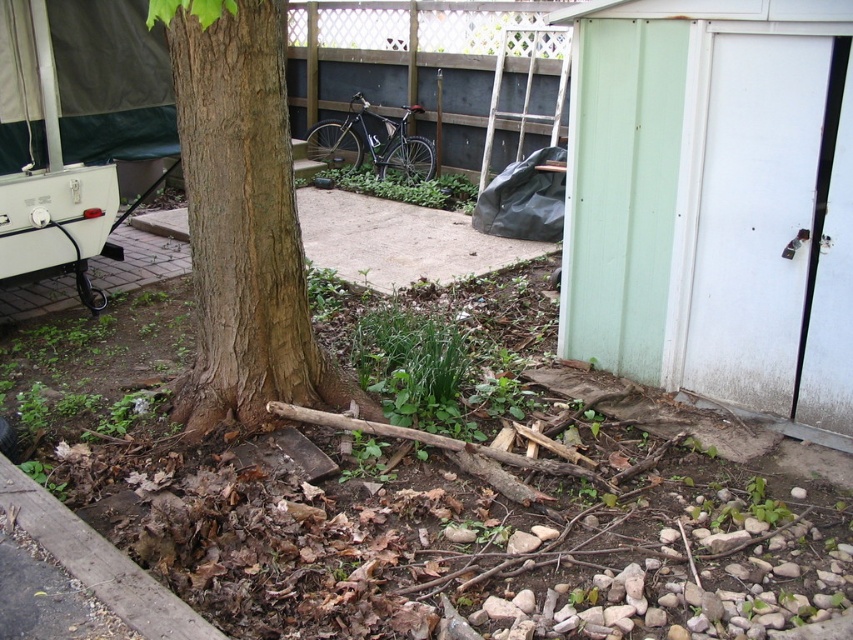
Question: From the image, what is the correct spatial relationship of brown rough bark tree at center in relation to matte black bicycle at center?

Choices:
 (A) left
 (B) right

Answer: (A)

Question: Does brown rough bark tree at center have a lesser width compared to matte black bicycle at center?

Choices:
 (A) yes
 (B) no

Answer: (A)

Question: Does brown rough bark tree at center lie in front of matte black bicycle at center?

Choices:
 (A) no
 (B) yes

Answer: (B)

Question: Which point appears closest to the camera in this image?

Choices:
 (A) (392, 157)
 (B) (289, 189)

Answer: (B)

Question: Among these points, which one is farthest from the camera?

Choices:
 (A) (416, 180)
 (B) (305, 317)

Answer: (A)